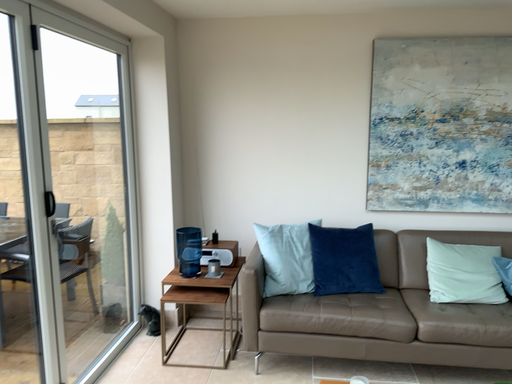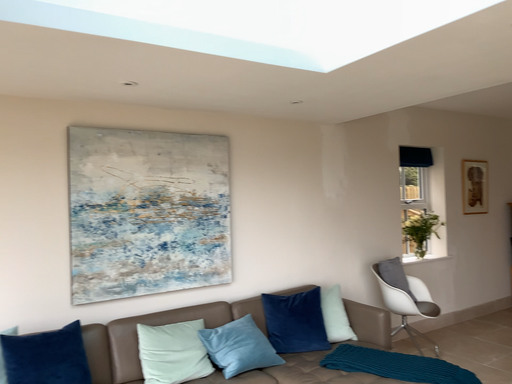
Question: Which way did the camera rotate in the video?

Choices:
 (A) rotated right
 (B) rotated left

Answer: (A)